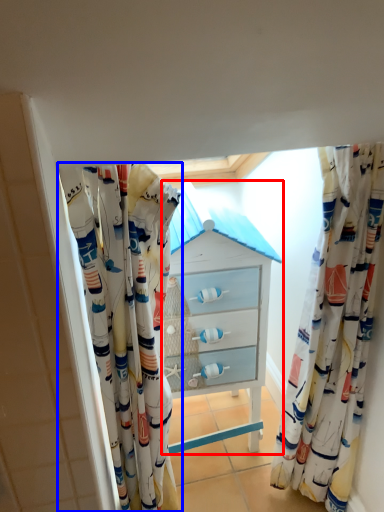
Question: Which object appears farthest to the camera in this image, chest of drawers (highlighted by a red box) or curtain (highlighted by a blue box)?

Choices:
 (A) chest of drawers
 (B) curtain

Answer: (A)